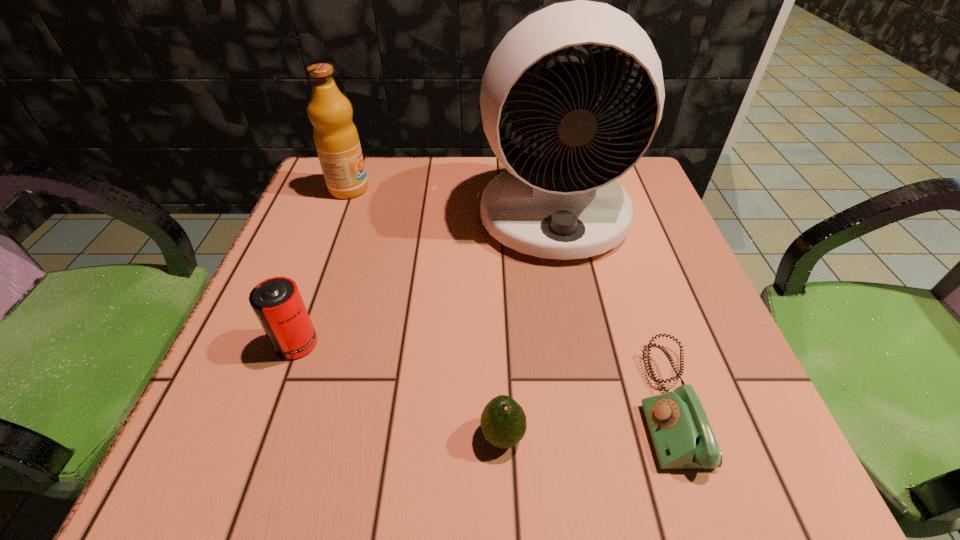
At what (x,y) coordinates should I click in order to perform the action: click on object at the far left corner. Please return your answer as a coordinate pair (x, y). Looking at the image, I should click on (336, 139).

What are the coordinates of `object situated at the far right corner` in the screenshot? It's located at (565, 206).

What are the coordinates of `object situated at the near right corner` in the screenshot? It's located at (681, 434).

The height and width of the screenshot is (540, 960). Find the location of `free space at the far edge of the desktop`. free space at the far edge of the desktop is located at coordinates (412, 193).

This screenshot has height=540, width=960. In order to click on vacant space at the near edge of the desktop in this screenshot , I will do `click(547, 453)`.

This screenshot has width=960, height=540. Identify the location of free space at the left edge of the desktop. point(364,232).

Locate an element on the screen. vacant space at the right edge of the desktop is located at coordinates (609, 260).

In the image, there is a desktop. Where is `free space at the far left corner`? This screenshot has height=540, width=960. free space at the far left corner is located at coordinates (321, 176).

In the image, there is a desktop. Where is `vacant region at the far right corner`? The width and height of the screenshot is (960, 540). vacant region at the far right corner is located at coordinates point(659,200).

This screenshot has width=960, height=540. Find the location of `vacant space that is in between the tallest object and the second shortest object`. vacant space that is in between the tallest object and the second shortest object is located at coordinates (528, 326).